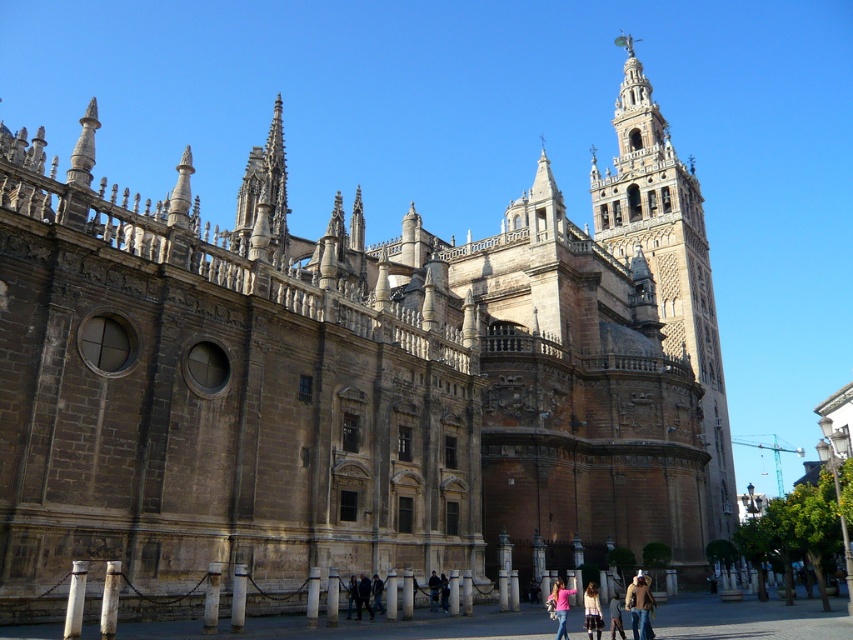
Is light brown leather jacket at lower center shorter than pink fabric at center?

In fact, light brown leather jacket at lower center may be taller than pink fabric at center.

Locate an element on the screen. light brown leather jacket at lower center is located at coordinates pyautogui.click(x=592, y=611).

The width and height of the screenshot is (853, 640). Identify the location of light brown leather jacket at lower center. (592, 611).

Between brown stone tower at upper right and dark brown leather jacket at center, which one has less height?

Standing shorter between the two is dark brown leather jacket at center.

Does brown stone tower at upper right have a lesser width compared to dark brown leather jacket at center?

No, brown stone tower at upper right is not thinner than dark brown leather jacket at center.

Identify the location of brown stone tower at upper right. (668, 262).

Between denim jacket at lower right and dark blue jeans at center, which one appears on the right side from the viewer's perspective?

From the viewer's perspective, denim jacket at lower right appears more on the right side.

Who is more forward, (631,600) or (366,577)?

Point (631,600) is in front.

Locate an element on the screen. The image size is (853, 640). denim jacket at lower right is located at coordinates (639, 608).